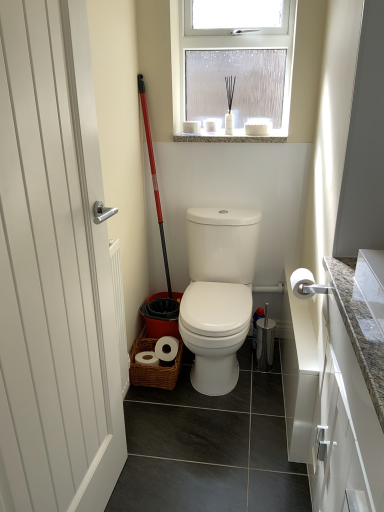
Question: Considering the relative sizes of red plastic shovel at center and granite at upper center in the image provided, is red plastic shovel at center shorter than granite at upper center?

Choices:
 (A) no
 (B) yes

Answer: (A)

Question: Is red plastic shovel at center to the left of granite at upper center from the viewer's perspective?

Choices:
 (A) yes
 (B) no

Answer: (A)

Question: Does red plastic shovel at center have a smaller size compared to granite at upper center?

Choices:
 (A) no
 (B) yes

Answer: (A)

Question: Is the depth of red plastic shovel at center less than that of granite at upper center?

Choices:
 (A) yes
 (B) no

Answer: (A)

Question: Is red plastic shovel at center taller than granite at upper center?

Choices:
 (A) yes
 (B) no

Answer: (A)

Question: From a real-world perspective, does red plastic shovel at center stand above granite at upper center?

Choices:
 (A) no
 (B) yes

Answer: (A)

Question: Considering the relative sizes of red plastic shovel at center and white matte toilet paper at right in the image provided, is red plastic shovel at center thinner than white matte toilet paper at right?

Choices:
 (A) yes
 (B) no

Answer: (A)

Question: Considering the relative sizes of red plastic shovel at center and white matte toilet paper at right in the image provided, is red plastic shovel at center bigger than white matte toilet paper at right?

Choices:
 (A) no
 (B) yes

Answer: (B)

Question: Does red plastic shovel at center appear on the right side of white matte toilet paper at right?

Choices:
 (A) yes
 (B) no

Answer: (B)

Question: Considering the relative sizes of red plastic shovel at center and white matte toilet paper at right in the image provided, is red plastic shovel at center wider than white matte toilet paper at right?

Choices:
 (A) yes
 (B) no

Answer: (B)

Question: Is red plastic shovel at center taller than white matte toilet paper at right?

Choices:
 (A) no
 (B) yes

Answer: (B)

Question: Considering the relative sizes of red plastic shovel at center and white matte toilet paper at right in the image provided, is red plastic shovel at center smaller than white matte toilet paper at right?

Choices:
 (A) yes
 (B) no

Answer: (B)

Question: Considering the relative sizes of white glossy toilet at center and clear frosted glass at upper center in the image provided, is white glossy toilet at center taller than clear frosted glass at upper center?

Choices:
 (A) no
 (B) yes

Answer: (B)